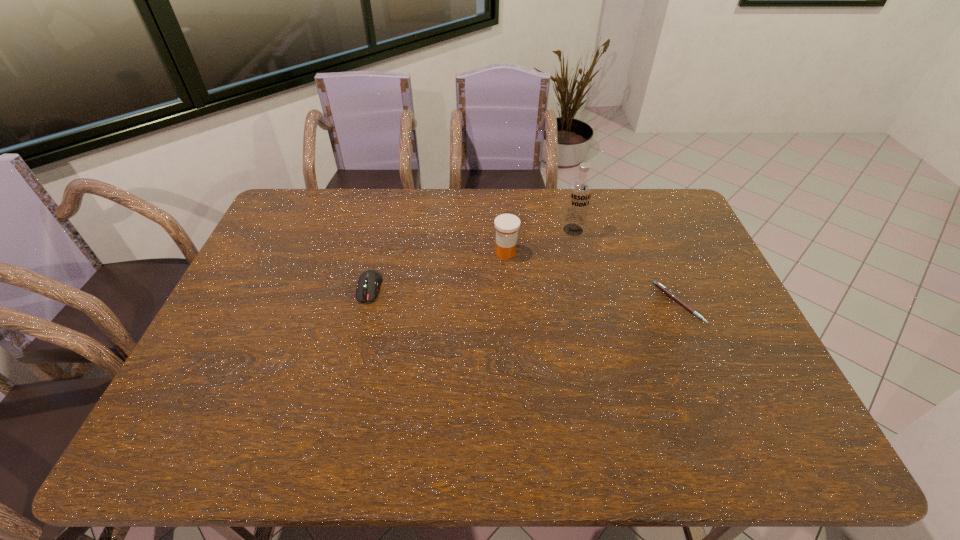
Where is `free point that satisfies the following two spatial constraints: 1. on the button of the shortest object; 2. at the nib of the computer equipment`? Image resolution: width=960 pixels, height=540 pixels. free point that satisfies the following two spatial constraints: 1. on the button of the shortest object; 2. at the nib of the computer equipment is located at coordinates (366, 303).

Where is `free spot that satisfies the following two spatial constraints: 1. on the front side of the shortest object; 2. at the nib of the farthest object`? free spot that satisfies the following two spatial constraints: 1. on the front side of the shortest object; 2. at the nib of the farthest object is located at coordinates (590, 303).